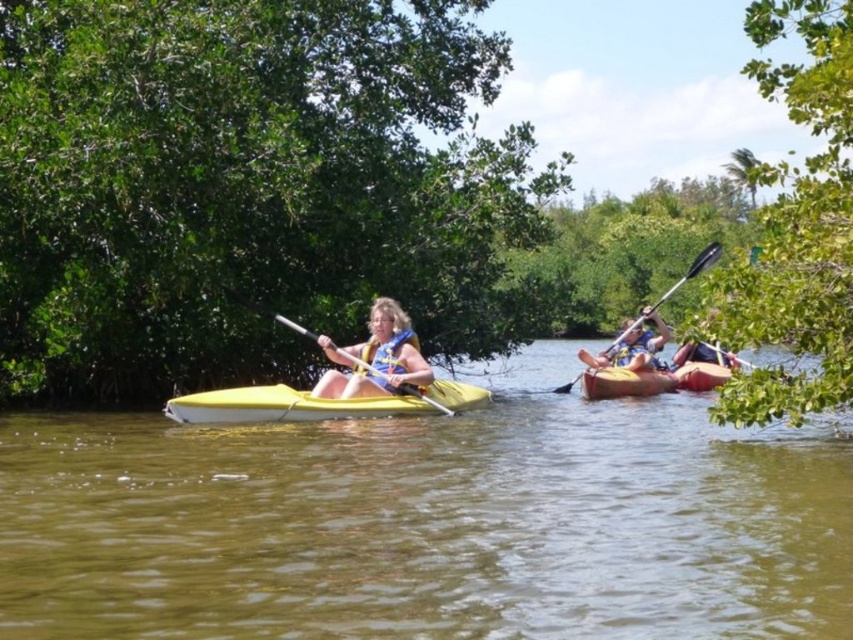
Find the location of a particular element. This screenshot has width=853, height=640. yellow life vest at center is located at coordinates (376, 356).

Find the location of a particular element. The height and width of the screenshot is (640, 853). yellow life vest at center is located at coordinates (376, 356).

Does yellow plastic paddle at center come behind yellow plastic kayak at right?

That is True.

Is yellow plastic paddle at center to the left of yellow plastic kayak at right from the viewer's perspective?

Correct, you'll find yellow plastic paddle at center to the left of yellow plastic kayak at right.

Looking at this image, measure the distance between yellow plastic paddle at center and camera.

yellow plastic paddle at center is 14.06 meters from camera.

Locate an element on the screen. yellow plastic paddle at center is located at coordinates (270, 312).

The image size is (853, 640). What are the coordinates of `yellow life vest at center` in the screenshot? It's located at [x=376, y=356].

Does yellow life vest at center come behind yellow plastic paddle at center?

No, yellow life vest at center is closer to the viewer.

This screenshot has height=640, width=853. What do you see at coordinates (376, 356) in the screenshot? I see `yellow life vest at center` at bounding box center [376, 356].

The width and height of the screenshot is (853, 640). I want to click on yellow life vest at center, so click(376, 356).